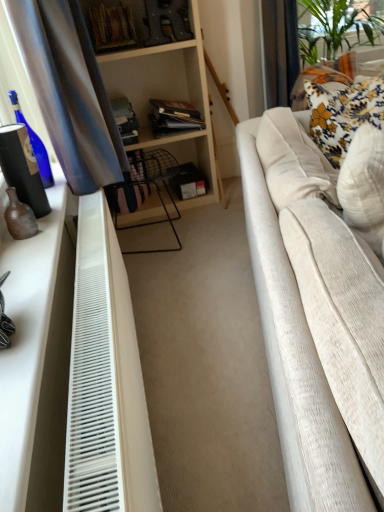
Question: Could you tell me if white textured pillow at right, acting as the second pillow starting from the back, is facing beige fabric couch at right?

Choices:
 (A) yes
 (B) no

Answer: (A)

Question: Is the depth of white textured pillow at right, acting as the second pillow starting from the back, greater than that of beige fabric couch at right?

Choices:
 (A) no
 (B) yes

Answer: (B)

Question: Is the depth of white textured pillow at right, acting as the second pillow starting from the back, less than that of beige fabric couch at right?

Choices:
 (A) no
 (B) yes

Answer: (A)

Question: Is white textured pillow at right, the 1th pillow viewed from the front, oriented away from beige fabric couch at right?

Choices:
 (A) no
 (B) yes

Answer: (B)

Question: From a real-world perspective, does white textured pillow at right, acting as the second pillow starting from the back, stand above beige fabric couch at right?

Choices:
 (A) yes
 (B) no

Answer: (A)

Question: Would you say beige fabric couch at right is part of white textured pillow at right, the 1th pillow viewed from the front,'s contents?

Choices:
 (A) no
 (B) yes

Answer: (A)

Question: Is beige fabric couch at right not near floral fabric pillow at upper right, marked as the first pillow in a back-to-front arrangement?

Choices:
 (A) no
 (B) yes

Answer: (A)

Question: Considering the relative sizes of beige fabric couch at right and floral fabric pillow at upper right, marked as the 2th pillow in a front-to-back arrangement, in the image provided, is beige fabric couch at right wider than floral fabric pillow at upper right, marked as the 2th pillow in a front-to-back arrangement,?

Choices:
 (A) yes
 (B) no

Answer: (A)

Question: From a real-world perspective, is beige fabric couch at right located higher than floral fabric pillow at upper right, marked as the first pillow in a back-to-front arrangement?

Choices:
 (A) yes
 (B) no

Answer: (B)

Question: Can you confirm if beige fabric couch at right is positioned to the left of floral fabric pillow at upper right, marked as the 2th pillow in a front-to-back arrangement?

Choices:
 (A) no
 (B) yes

Answer: (B)

Question: Are beige fabric couch at right and floral fabric pillow at upper right, marked as the first pillow in a back-to-front arrangement, beside each other?

Choices:
 (A) yes
 (B) no

Answer: (B)

Question: Is beige fabric couch at right positioned before floral fabric pillow at upper right, marked as the 2th pillow in a front-to-back arrangement?

Choices:
 (A) no
 (B) yes

Answer: (B)

Question: Would you say white textured pillow at right, the 1th pillow viewed from the front, is outside white plastic radiator at lower left?

Choices:
 (A) yes
 (B) no

Answer: (A)